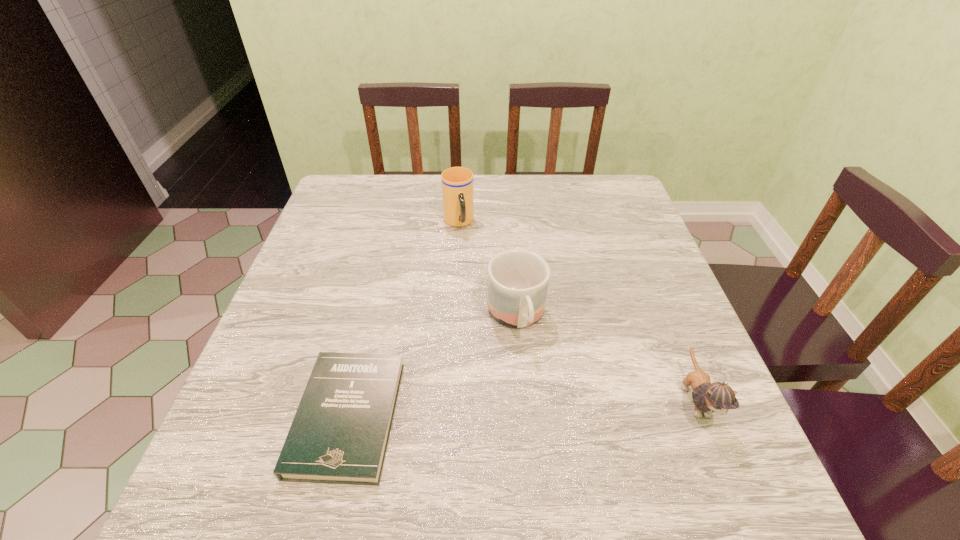
Identify the location of free spot on the desktop that is between the shortest object and the kitten and is positioned on the side of the cup with the handle. (523, 408).

This screenshot has height=540, width=960. In order to click on free space on the desktop that is between the shortest object and the kitten and is positioned on the side with the handle of the second object from right to left in this screenshot , I will do `click(545, 407)`.